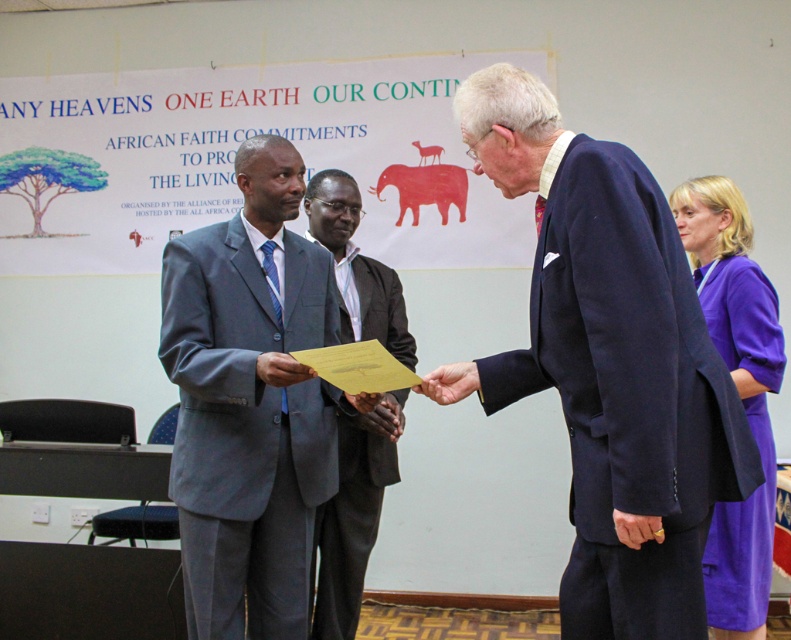
Question: Can you confirm if purple fabric dress at right is positioned to the right of light blue fabric suit at center?

Choices:
 (A) no
 (B) yes

Answer: (B)

Question: Which of the following is the farthest from the observer?

Choices:
 (A) light blue fabric suit at center
 (B) purple fabric dress at right
 (C) navy blue suit at center
 (D) matte gray suit at center

Answer: (A)

Question: Where is navy blue suit at center located in relation to light blue fabric suit at center in the image?

Choices:
 (A) right
 (B) left

Answer: (A)

Question: Does matte gray suit at center have a lesser width compared to light blue fabric suit at center?

Choices:
 (A) yes
 (B) no

Answer: (B)

Question: Which point is farther to the camera?

Choices:
 (A) light blue fabric suit at center
 (B) purple fabric dress at right
 (C) navy blue suit at center

Answer: (A)

Question: Among these objects, which one is nearest to the camera?

Choices:
 (A) light blue fabric suit at center
 (B) navy blue suit at center
 (C) purple fabric dress at right

Answer: (B)